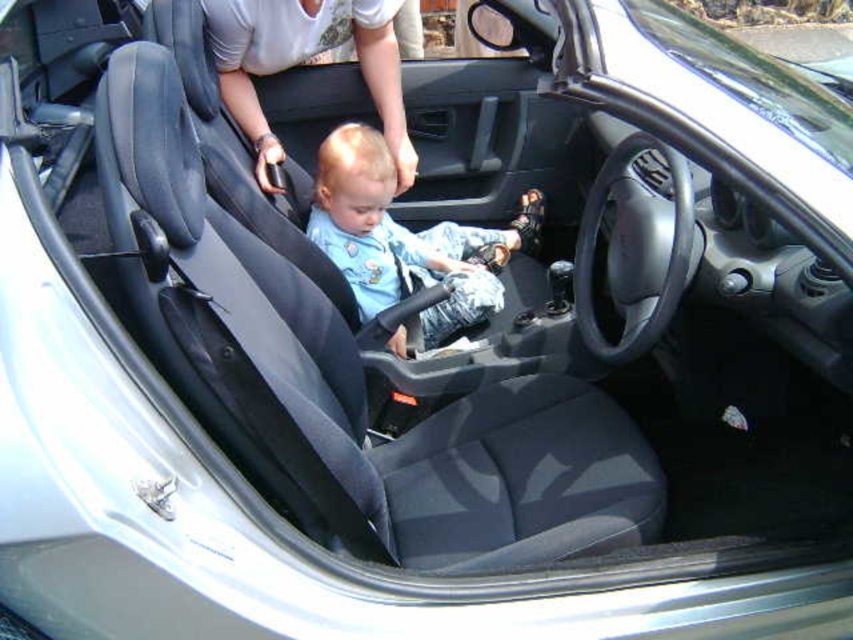
Looking at this image, you are a passenger in the car and want to locate the matte blue shirt at center. Where would you look relative to your position in the car?

The matte blue shirt at center is located at the driver seat, which is on the right side of the car from the passenger perspective.

You are a passenger in the car and want to reach an object located at point (347, 264) and another object at point (212, 16). Which point is closer to you?

Point (212, 16) is closer to you because it is nearer to the camera compared to point (347, 264), which is further away.

You are a passenger in the car and notice two shirts inside the vehicle. The first is a matte blue shirt at center and the second is a white fabric shirt at upper center. Which shirt is positioned lower in the car?

The matte blue shirt at center is located below the white fabric shirt at upper center, so the matte blue shirt at center is positioned lower in the car.